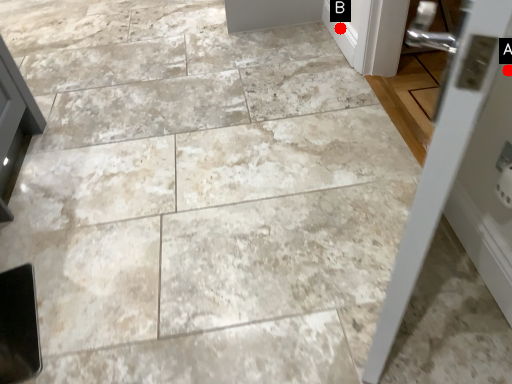
Question: Two points are circled on the image, labeled by A and B beside each circle. Which point appears closest to the camera in this image?

Choices:
 (A) A is closer
 (B) B is closer

Answer: (A)